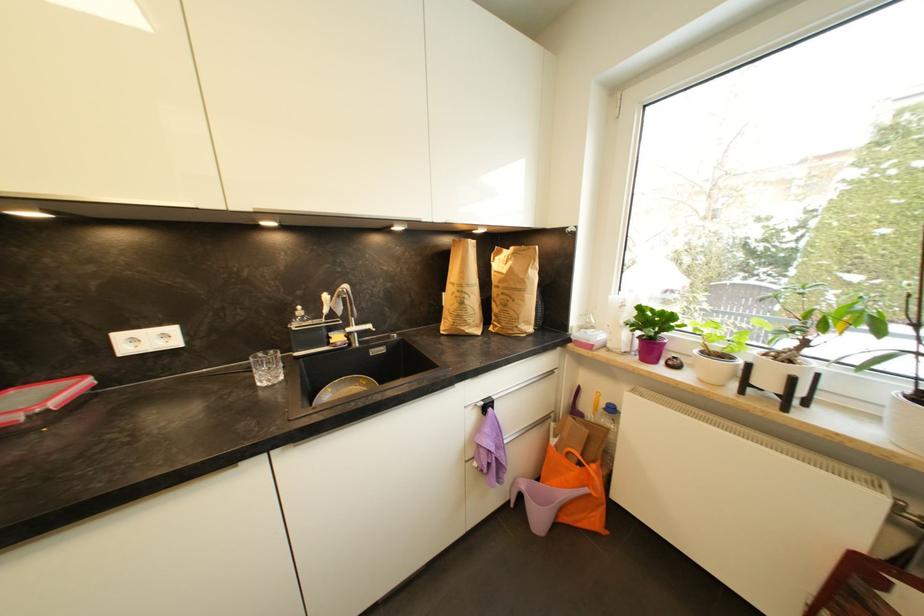
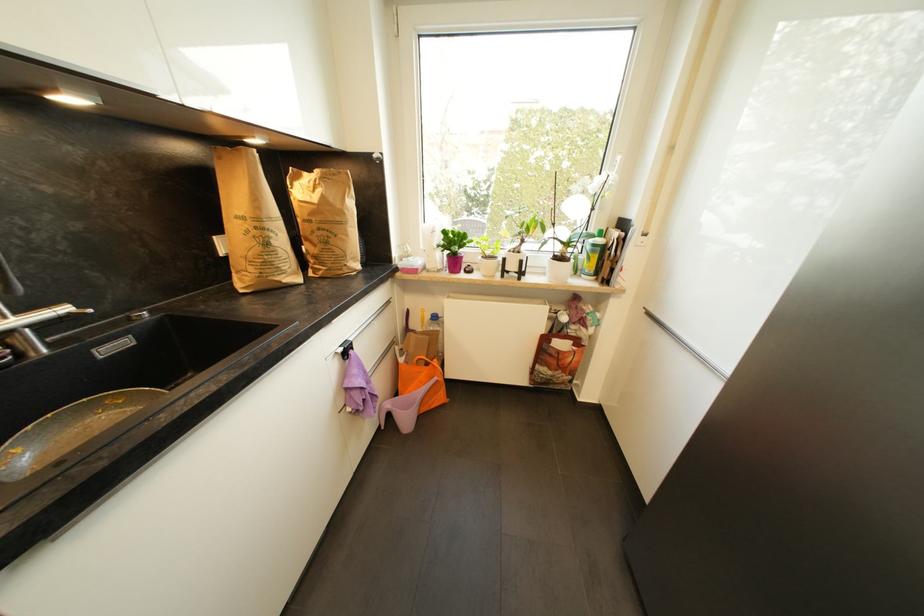
The point at (362,326) is marked in the first image. Where is the corresponding point in the second image?

(27, 313)